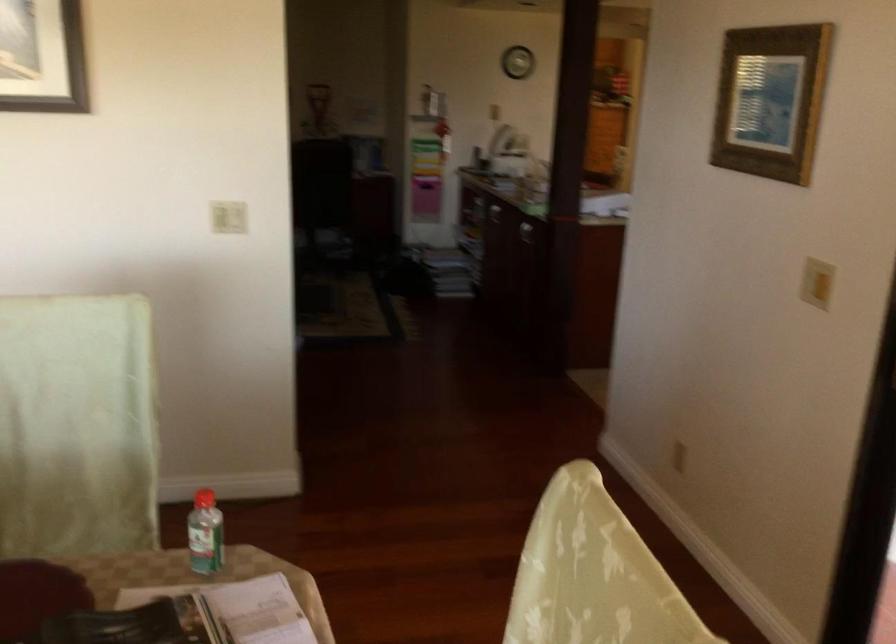
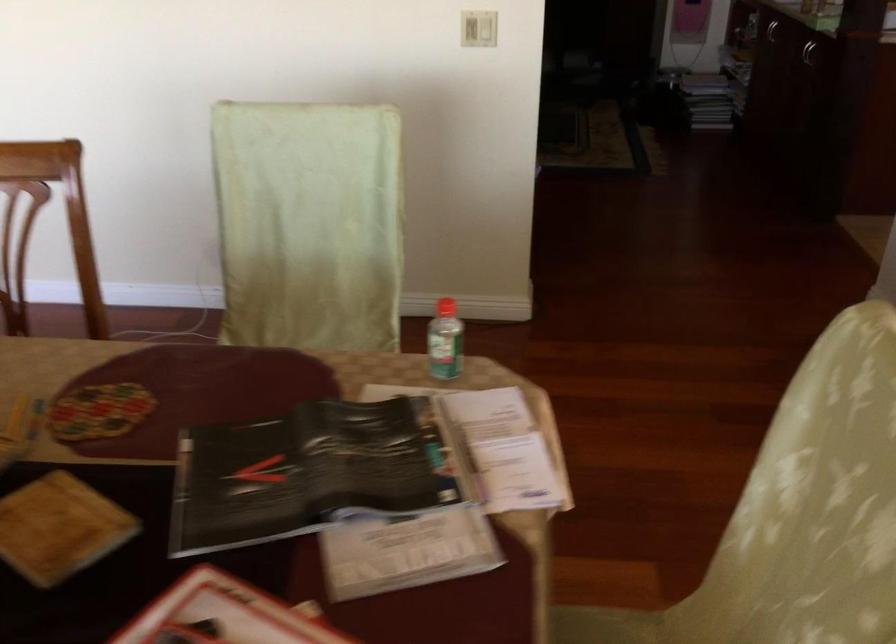
Where in the second image is the point corresponding to (x=230, y=222) from the first image?

(478, 29)